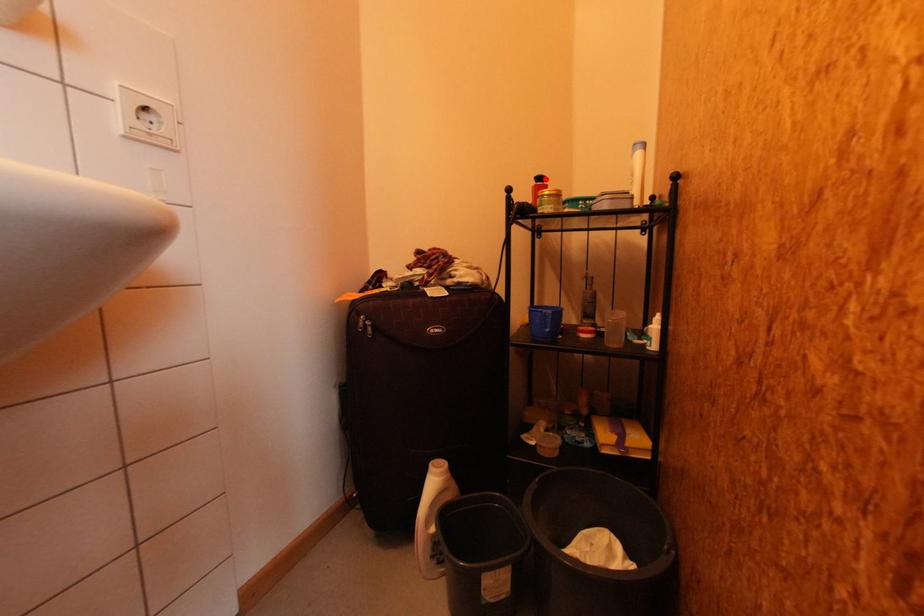
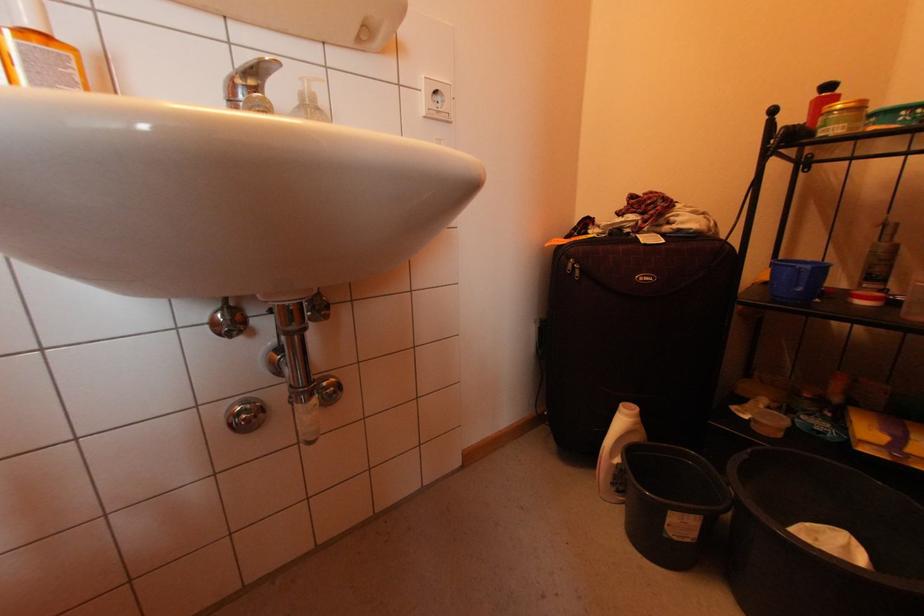
Locate, in the second image, the point that corresponds to the highlighted location in the first image.

(833, 87)